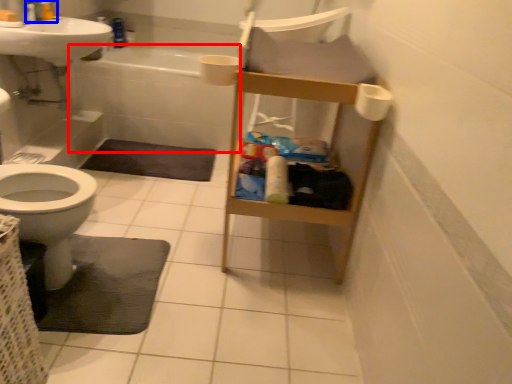
Question: Which object is closer to the camera taking this photo, bath (highlighted by a red box) or plumbing fixture (highlighted by a blue box)?

Choices:
 (A) bath
 (B) plumbing fixture

Answer: (B)